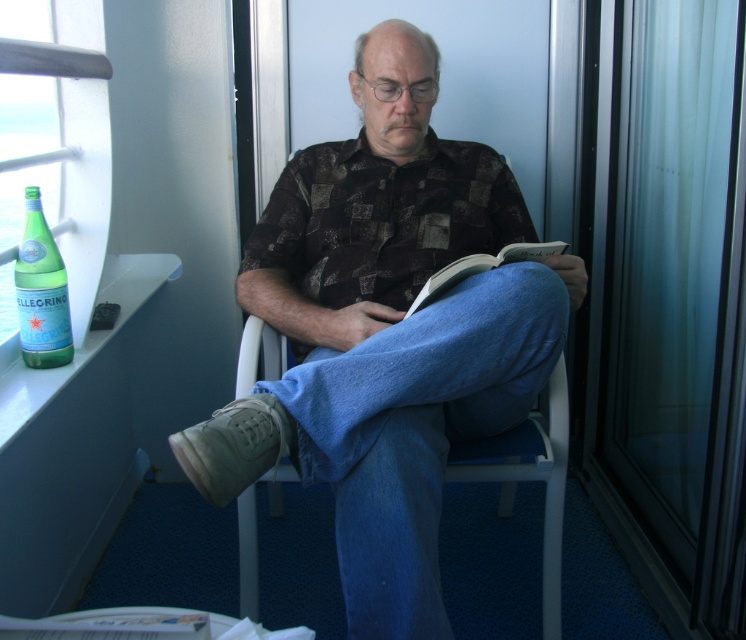
Question: Which of the following is the farthest from the observer?

Choices:
 (A) blue fabric chair at lower center
 (B) white paper book at lower left
 (C) green glass bottle at left
 (D) matte brown shirt at center

Answer: (A)

Question: Which object is positioned farthest from the blue fabric chair at lower center?

Choices:
 (A) green glass bottle at left
 (B) hardcover book at center
 (C) white paper book at lower left
 (D) matte brown shirt at center

Answer: (A)

Question: Can you confirm if green glass bottle at left is positioned to the left of white paper book at lower left?

Choices:
 (A) yes
 (B) no

Answer: (A)

Question: Which of the following is the farthest from the observer?

Choices:
 (A) white paper book at lower left
 (B) matte brown shirt at center
 (C) blue fabric chair at lower center
 (D) green glass bottle at left

Answer: (C)

Question: Is white paper book at lower left behind hardcover book at center?

Choices:
 (A) yes
 (B) no

Answer: (B)

Question: Does blue fabric chair at lower center have a lesser width compared to green glass bottle at left?

Choices:
 (A) yes
 (B) no

Answer: (B)